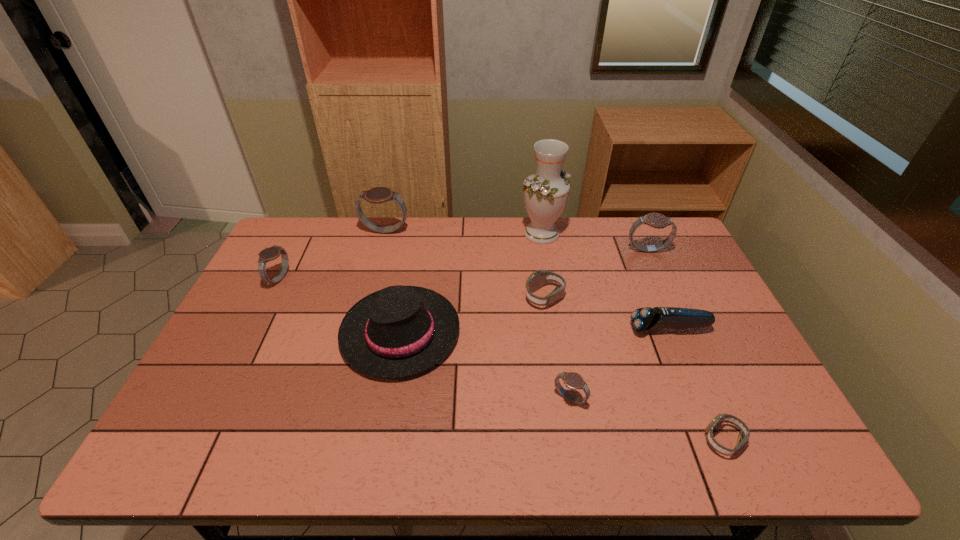
Locate an element on the screen. The width and height of the screenshot is (960, 540). the tallest object is located at coordinates (243, 412).

Where is `the tallest watch`? the tallest watch is located at coordinates (243, 412).

Identify the location of the farthest gray watch. (243, 412).

I want to click on the third smallest gray watch, so click(243, 412).

Image resolution: width=960 pixels, height=540 pixels. Find the location of `the fifth shortest watch`. the fifth shortest watch is located at coordinates (243, 412).

Locate an element on the screen. dress hat is located at coordinates (389, 379).

At what (x,y) coordinates should I click in order to perform the action: click on the leftmost object. Please return your answer as a coordinate pair (x, y). The image size is (960, 540). Looking at the image, I should click on (243, 412).

In order to click on the third farthest gray watch in this screenshot , I will do `click(243, 412)`.

Identify the location of the farther white watch. (243, 412).

At what (x,y) coordinates should I click in order to perform the action: click on the left white watch. Please return your answer as a coordinate pair (x, y). Looking at the image, I should click on (243, 412).